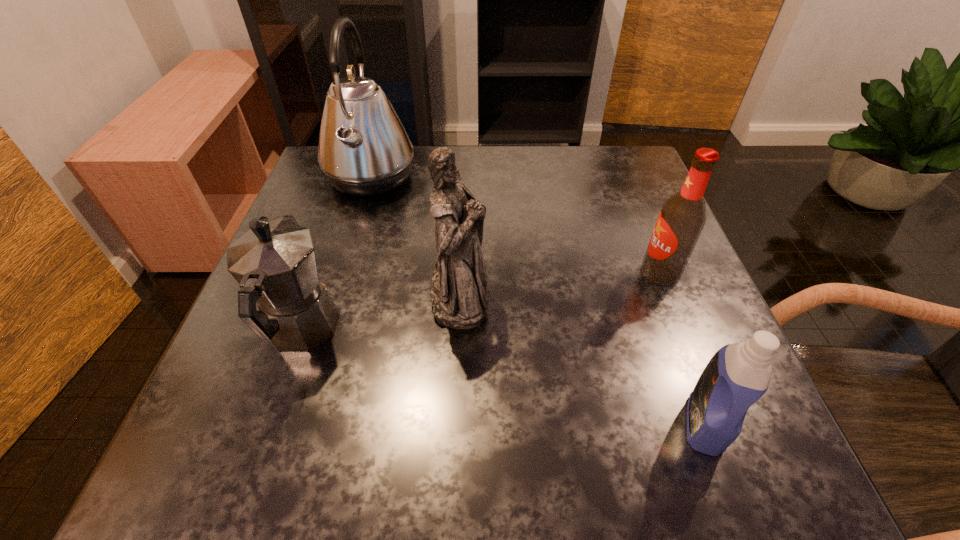
Locate an element on the screen. free space between the beer bottle and the nearest object is located at coordinates (682, 348).

You are a GUI agent. You are given a task and a screenshot of the screen. Output one action in this format:
    pyautogui.click(x=<x>, y=<y>)
    Task: Click on the unoccupied position between the nearest object and the figurine
    The width and height of the screenshot is (960, 540).
    Given the screenshot: What is the action you would take?
    pyautogui.click(x=582, y=360)

Identify the location of vacant area between the farthest object and the coffeepot. (336, 254).

Find the location of a particular element. vacant area that lies between the nearest object and the coffeepot is located at coordinates (503, 377).

In order to click on vacant space that is in between the third object from left to right and the nearest object in this screenshot , I will do `click(582, 360)`.

Find the location of a particular element. The height and width of the screenshot is (540, 960). vacant area that lies between the beer bottle and the figurine is located at coordinates (560, 284).

Identify which object is located as the fourth nearest to the tallest object. Please provide its 2D coordinates. Your answer should be formatted as a tuple, i.e. [(x, y)], where the tuple contains the x and y coordinates of a point satisfying the conditions above.

[(738, 374)]

Identify which object is located as the third nearest to the nearest object. Please provide its 2D coordinates. Your answer should be formatted as a tuple, i.e. [(x, y)], where the tuple contains the x and y coordinates of a point satisfying the conditions above.

[(274, 262)]

The image size is (960, 540). In order to click on vacant region that satisfies the following two spatial constraints: 1. from the spout of the nearest object; 2. on the right side of the kettle in this screenshot , I will do `click(295, 423)`.

The image size is (960, 540). What are the coordinates of `vacant space that satisfies the following two spatial constraints: 1. from the spout of the beer bottle; 2. on the left side of the farthest object` in the screenshot? It's located at (342, 272).